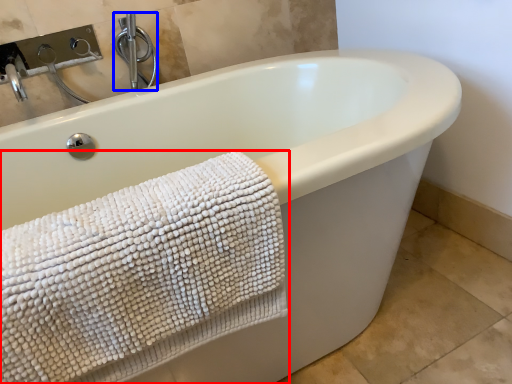
Question: Which of the following is the closest to the observer, towel (highlighted by a red box) or faucet (highlighted by a blue box)?

Choices:
 (A) towel
 (B) faucet

Answer: (A)